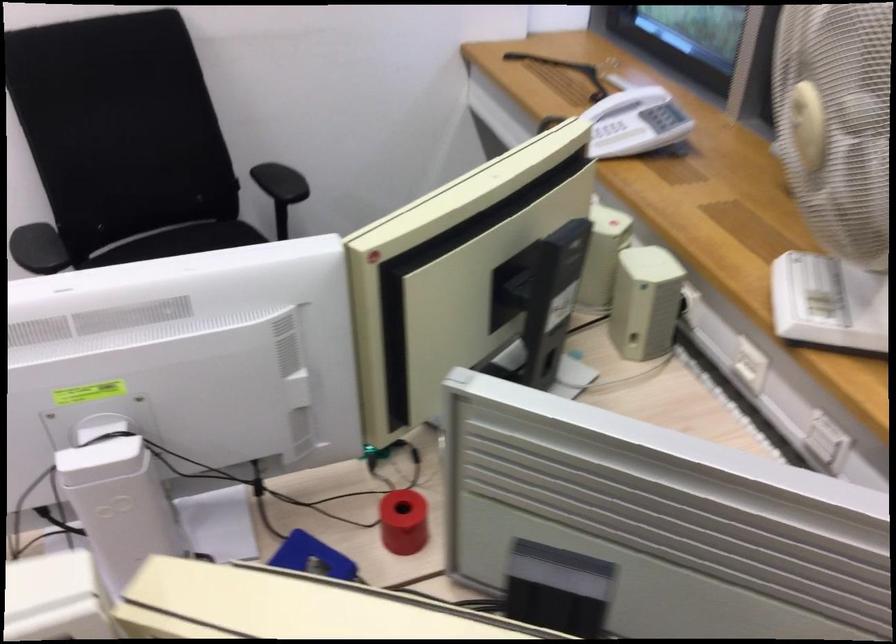
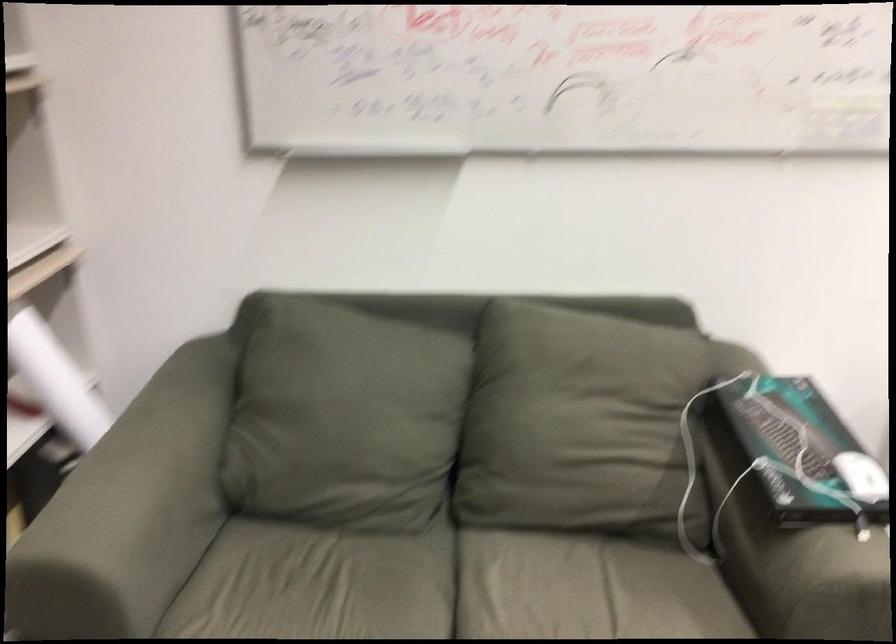
Question: Which direction would the cameraman need to move to produce the second image? Reply with the corresponding letter.

Choices:
 (A) Left
 (B) Right
 (C) Forward
 (D) Backward

Answer: (A)